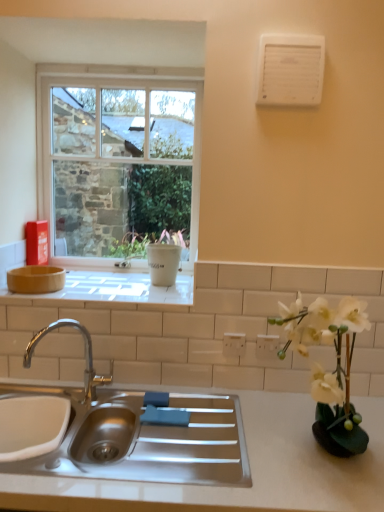
Image resolution: width=384 pixels, height=512 pixels. In order to click on vacant space situated on the left part of white matte vase at right in this screenshot , I will do `click(245, 468)`.